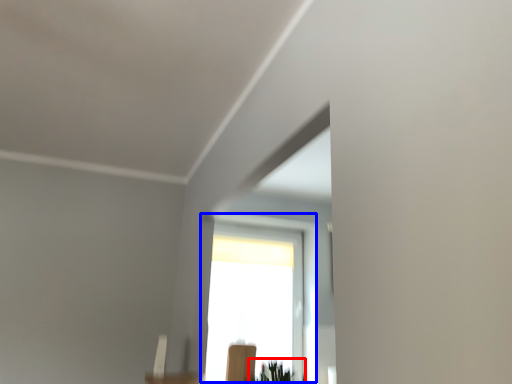
Question: Which object is further to the camera taking this photo, plant (highlighted by a red box) or window (highlighted by a blue box)?

Choices:
 (A) plant
 (B) window

Answer: (B)